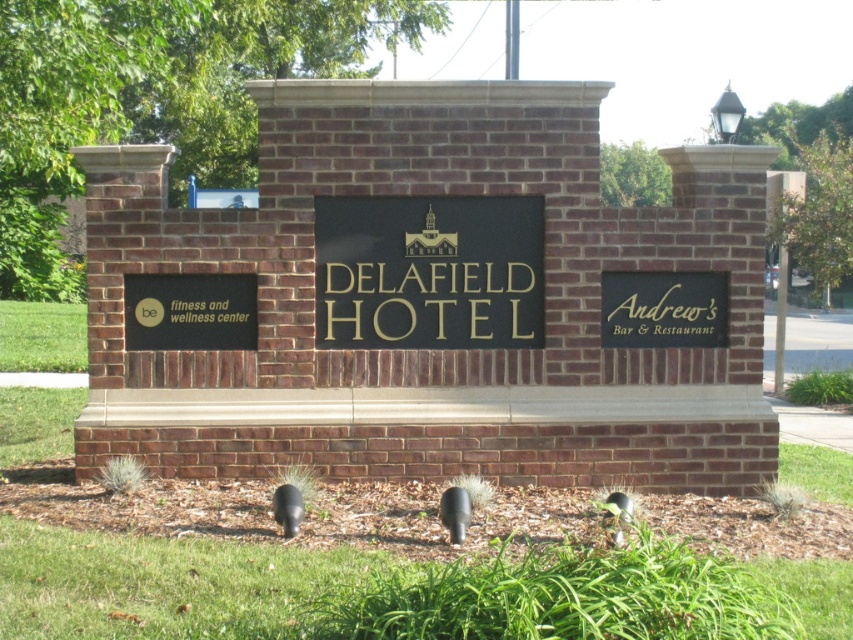
You are standing in front of the Delafield Hotel monument sign. You notice two black matte signs. One is labeled as the black matte sign at lower left and the other as the black matte sign at right. Which of these two signs is closer to you?

The black matte sign at lower left is closer to you because it is positioned in front of the black matte sign at right.